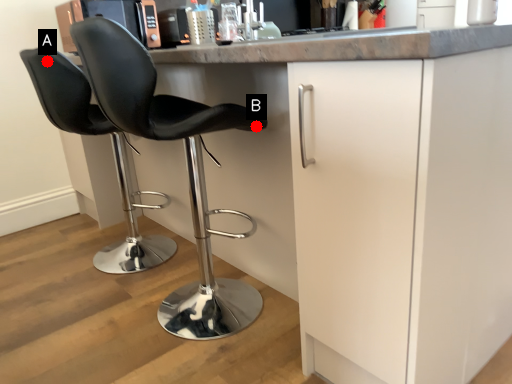
Question: Two points are circled on the image, labeled by A and B beside each circle. Which of the following is the farthest from the observer?

Choices:
 (A) A is further
 (B) B is further

Answer: (A)